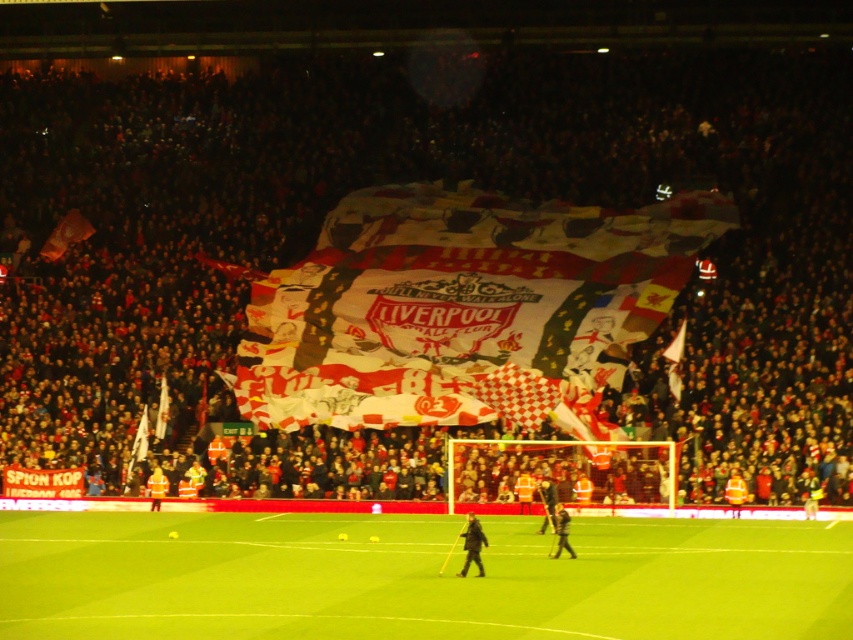
Between dark gray fabric at center and reflective silver jacket at center, which one is positioned lower?

reflective silver jacket at center

Between point (553, 528) and point (149, 480), which one is positioned in front?

Point (553, 528) is in front.

Which is in front, point (547, 509) or point (154, 506)?

Point (547, 509) is more forward.

Image resolution: width=853 pixels, height=640 pixels. Identify the location of dark gray fabric at center. (547, 502).

Is white fabric crowd at center positioned behind dark fabric jacket at center?

Yes.

Is white fabric crowd at center wider than dark fabric jacket at center?

Correct, the width of white fabric crowd at center exceeds that of dark fabric jacket at center.

Does point (250, 140) come closer to viewer compared to point (474, 544)?

No.

Identify the location of white fabric crowd at center. Image resolution: width=853 pixels, height=640 pixels. (413, 179).

Is dark fabric jacket at center closer to the viewer compared to reflective silver jacket at center?

Yes.

Does point (468, 560) come farther from viewer compared to point (160, 483)?

No, (468, 560) is closer to viewer.

Find the location of a particular element. The image size is (853, 640). dark fabric jacket at center is located at coordinates (473, 545).